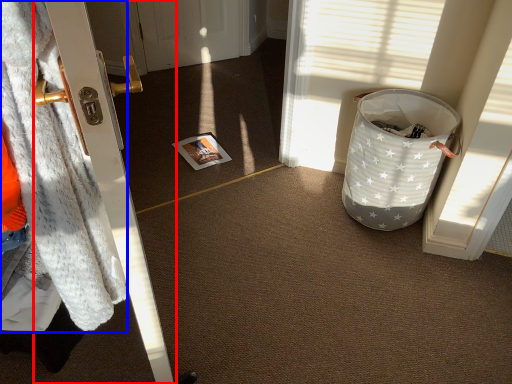
Question: Which point is further to the camera, door (highlighted by a red box) or blanket (highlighted by a blue box)?

Choices:
 (A) door
 (B) blanket

Answer: (A)